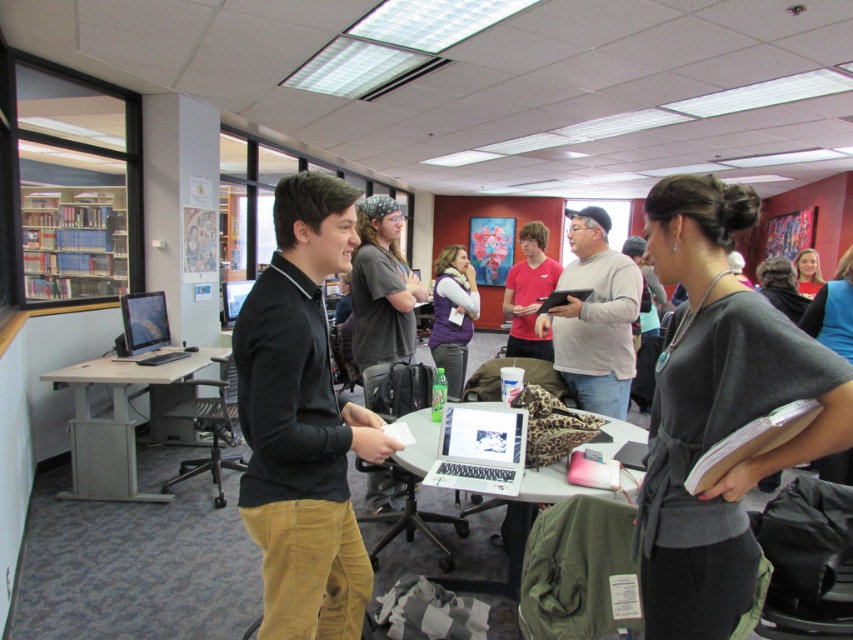
From the picture: Between silver metallic laptop at center and matte black laptop at left, which one has more height?

matte black laptop at left

Looking at this image, is silver metallic laptop at center to the left of matte black laptop at left from the viewer's perspective?

No, silver metallic laptop at center is not to the left of matte black laptop at left.

This screenshot has height=640, width=853. Identify the location of silver metallic laptop at center. (480, 451).

I want to click on silver metallic laptop at center, so click(480, 451).

Between white glossy laptop at center and matte purple vest at center, which one is positioned higher?

matte purple vest at center

Looking at this image, between white glossy laptop at center and matte purple vest at center, which one appears on the right side from the viewer's perspective?

white glossy laptop at center

Does point (509, 509) come behind point (454, 330)?

No, it is in front of (454, 330).

I want to click on white glossy laptop at center, so click(x=521, y=525).

Is wooden bookshelf at left shorter than light brown wooden desk at left?

No, wooden bookshelf at left is not shorter than light brown wooden desk at left.

What do you see at coordinates (74, 236) in the screenshot? I see `wooden bookshelf at left` at bounding box center [74, 236].

Is point (97, 280) farther from camera compared to point (221, 372)?

That is True.

Where is `wooden bookshelf at left`? wooden bookshelf at left is located at coordinates (74, 236).